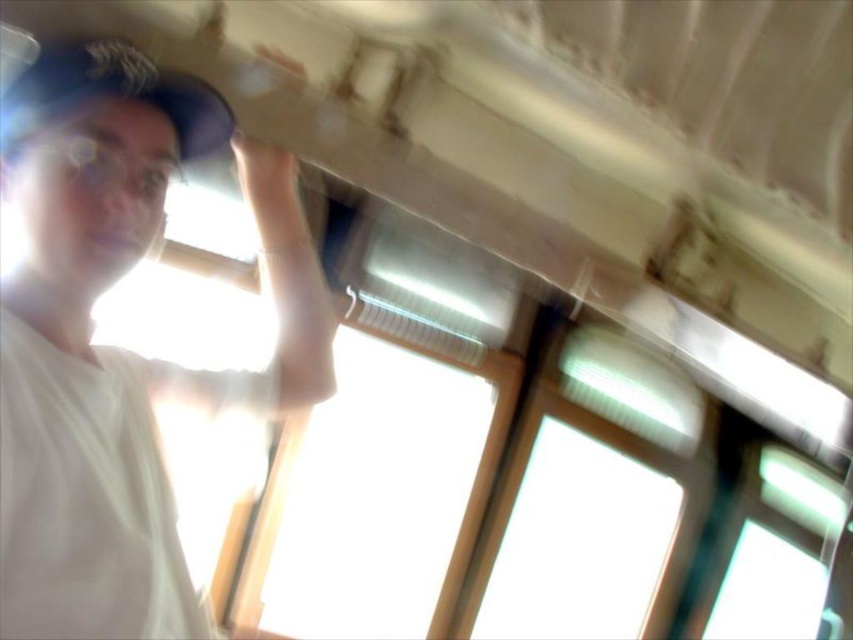
Question: Is white matte t-shirt at upper left to the right of white fabric baseball hat at upper left from the viewer's perspective?

Choices:
 (A) no
 (B) yes

Answer: (B)

Question: Does white matte t-shirt at upper left appear over matte skin hand at upper center?

Choices:
 (A) yes
 (B) no

Answer: (B)

Question: Does white matte t-shirt at upper left appear over white fabric baseball hat at upper left?

Choices:
 (A) no
 (B) yes

Answer: (A)

Question: Which of the following is the closest to the observer?

Choices:
 (A) (234, 157)
 (B) (136, 218)

Answer: (B)

Question: Estimate the real-world distances between objects in this image. Which object is farther from the matte skin hand at upper center?

Choices:
 (A) white fabric baseball hat at upper left
 (B) white matte t-shirt at upper left

Answer: (B)

Question: Among these points, which one is farthest from the camera?

Choices:
 (A) (21, 504)
 (B) (288, 180)
 (C) (3, 109)

Answer: (B)